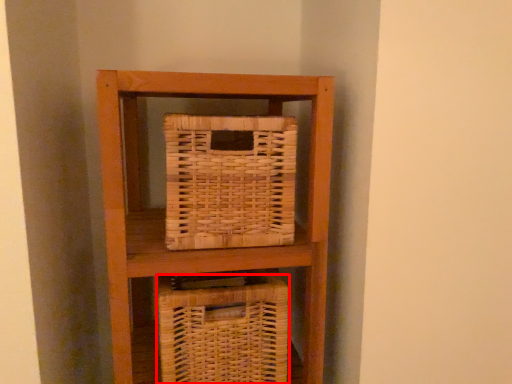
Question: In this image, where is basket (annotated by the red box) located relative to picnic basket?

Choices:
 (A) right
 (B) left

Answer: (B)